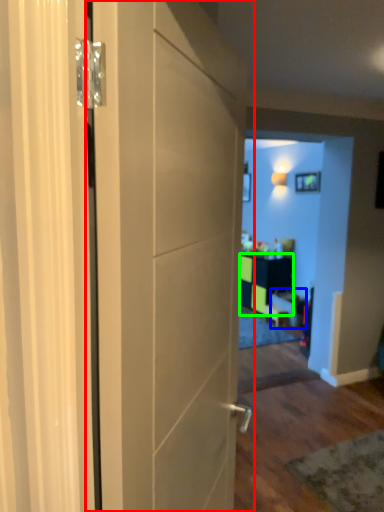
Question: Estimate the real-world distances between objects in this image. Which object is closer to door (highlighted by a red box), furniture (highlighted by a blue box) or cabinetry (highlighted by a green box)?

Choices:
 (A) furniture
 (B) cabinetry

Answer: (A)